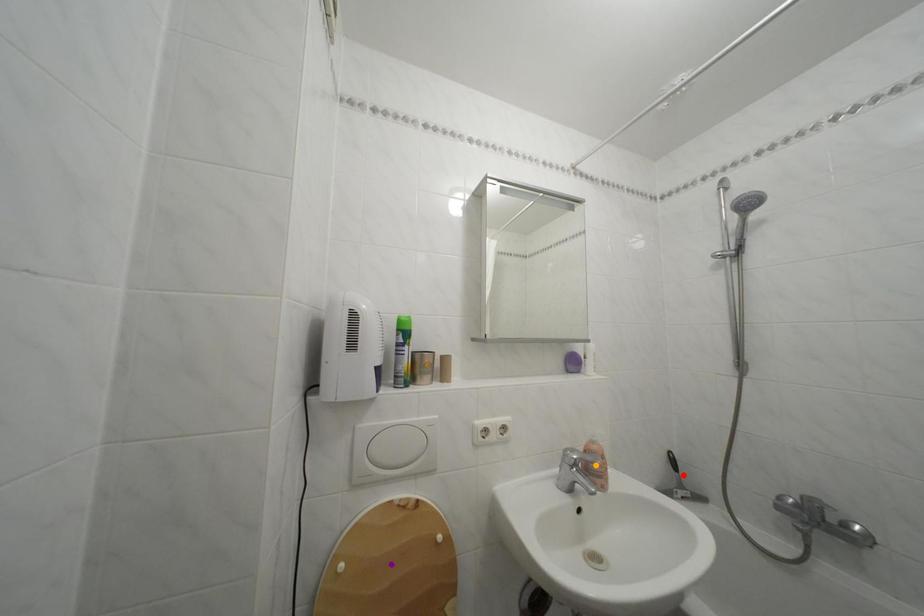
Order these from nearest to farthest:
- red point
- purple point
- orange point

purple point < orange point < red point